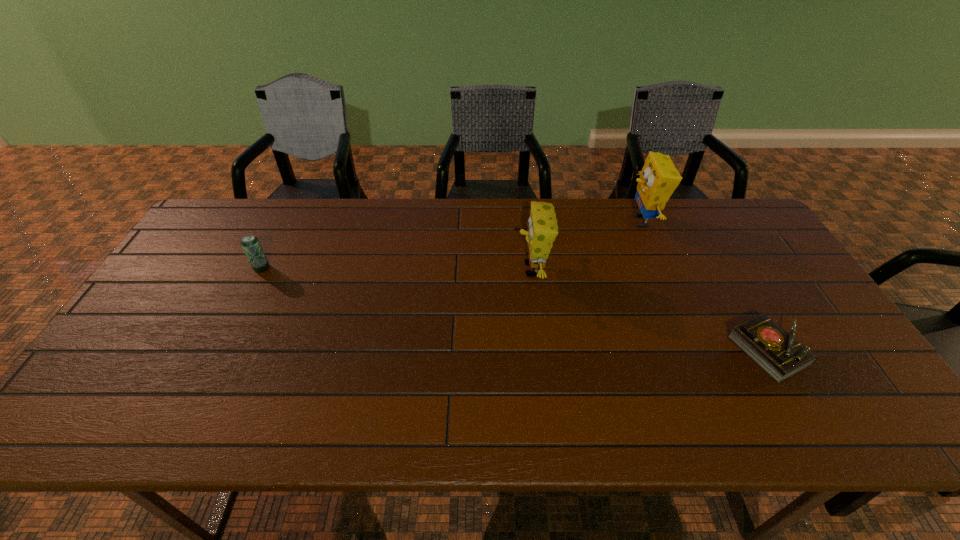
Identify the location of free space located on the face of the left sponge. The image size is (960, 540). (421, 269).

Locate an element on the screen. Image resolution: width=960 pixels, height=540 pixels. free location located on the face of the left sponge is located at coordinates (483, 269).

Where is `free space located 0.340m on the front of the beer can`? The width and height of the screenshot is (960, 540). free space located 0.340m on the front of the beer can is located at coordinates (208, 373).

Locate an element on the screen. vacant space located 0.050m on the front of the rightmost object is located at coordinates (797, 403).

Locate an element on the screen. This screenshot has width=960, height=540. object located at the right edge is located at coordinates (777, 352).

Find the location of `free space at the far edge of the desktop`. free space at the far edge of the desktop is located at coordinates (655, 221).

In the image, there is a desktop. Find the location of `blank space at the near edge`. blank space at the near edge is located at coordinates (575, 406).

Identify the location of vacant space at the left edge. Image resolution: width=960 pixels, height=540 pixels. (187, 286).

Identify the location of free location at the right edge of the desktop. The image size is (960, 540). (781, 296).

Where is `vacant space at the far left corner`? Image resolution: width=960 pixels, height=540 pixels. vacant space at the far left corner is located at coordinates (266, 205).